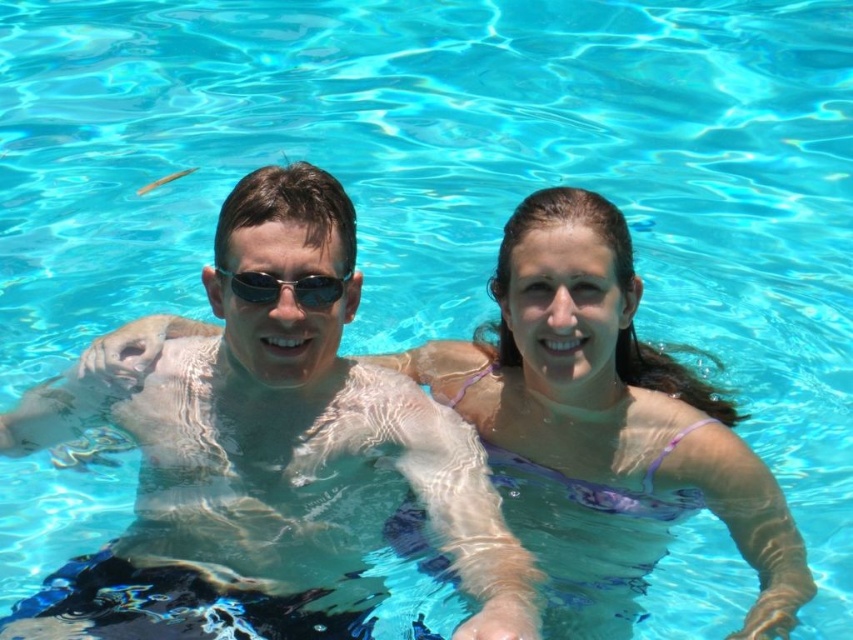
From the picture: Between glossy skin at center and sunglasses at center, which one appears on the right side from the viewer's perspective?

From the viewer's perspective, sunglasses at center appears more on the right side.

Does glossy skin at center appear under sunglasses at center?

Correct, glossy skin at center is located below sunglasses at center.

Image resolution: width=853 pixels, height=640 pixels. Identify the location of glossy skin at center. (271, 460).

The width and height of the screenshot is (853, 640). I want to click on glossy skin at center, so click(271, 460).

Which is more to the left, glossy skin at center or purple fabric bikini top at upper right?

From the viewer's perspective, glossy skin at center appears more on the left side.

Can you confirm if glossy skin at center is wider than purple fabric bikini top at upper right?

Correct, the width of glossy skin at center exceeds that of purple fabric bikini top at upper right.

Does point (341, 216) lie behind point (529, 340)?

No, it is in front of (529, 340).

Locate an element on the screen. The image size is (853, 640). glossy skin at center is located at coordinates (271, 460).

Between purple fabric bikini top at upper right and sunglasses at center, which one appears on the right side from the viewer's perspective?

Positioned to the right is purple fabric bikini top at upper right.

Is point (769, 499) positioned after point (340, 276)?

Yes, it is.

Is point (550, 202) positioned after point (322, 288)?

Yes, point (550, 202) is behind point (322, 288).

At what (x,y) coordinates should I click in order to perform the action: click on purple fabric bikini top at upper right. Please return your answer as a coordinate pair (x, y). Looking at the image, I should click on coord(604,422).